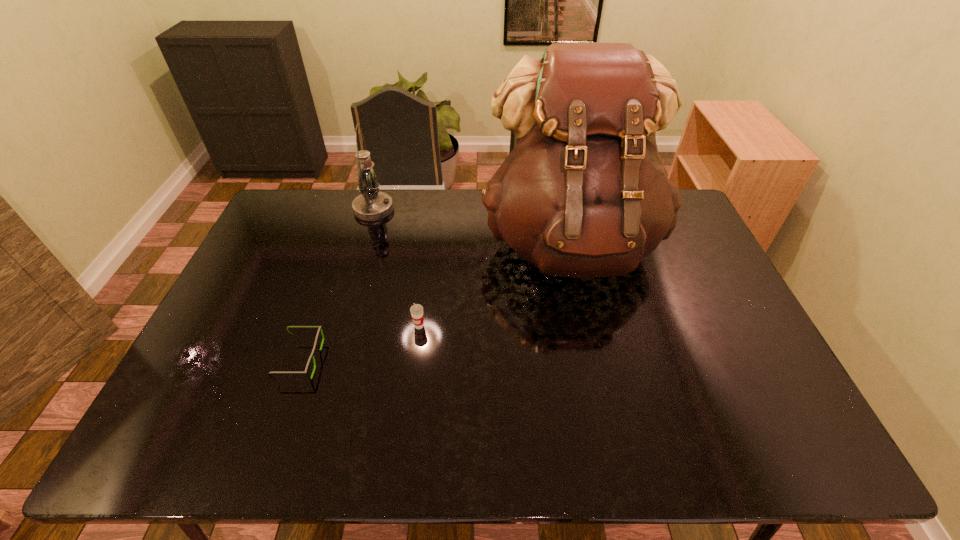
The image size is (960, 540). In order to click on free spot located 0.370m on the lens of the shortest object in this screenshot , I will do `click(461, 360)`.

Locate an element on the screen. The width and height of the screenshot is (960, 540). satchel that is positioned at the far edge is located at coordinates (584, 194).

This screenshot has height=540, width=960. What are the coordinates of `oil lamp present at the far edge` in the screenshot? It's located at (371, 205).

Where is `object that is positioned at the right edge`? Image resolution: width=960 pixels, height=540 pixels. object that is positioned at the right edge is located at coordinates 584,194.

Image resolution: width=960 pixels, height=540 pixels. In order to click on object that is at the far right corner in this screenshot , I will do `click(584, 194)`.

Find the location of a particular element. The image size is (960, 540). free region at the far edge of the desktop is located at coordinates (364, 221).

You are a GUI agent. You are given a task and a screenshot of the screen. Output one action in this format:
    pyautogui.click(x=<x>, y=<y>)
    Task: Click on the free space at the near edge
    The width and height of the screenshot is (960, 540).
    Given the screenshot: What is the action you would take?
    [271, 427]

Identify the location of vacant space at the left edge of the desktop. (297, 234).

In the image, there is a desktop. At what (x,y) coordinates should I click in order to perform the action: click on vacant area at the right edge. Please return your answer as a coordinate pair (x, y). The height and width of the screenshot is (540, 960). Looking at the image, I should click on (674, 236).

This screenshot has width=960, height=540. What are the coordinates of `blank region between the rightmost object and the oil lamp` in the screenshot? It's located at (472, 226).